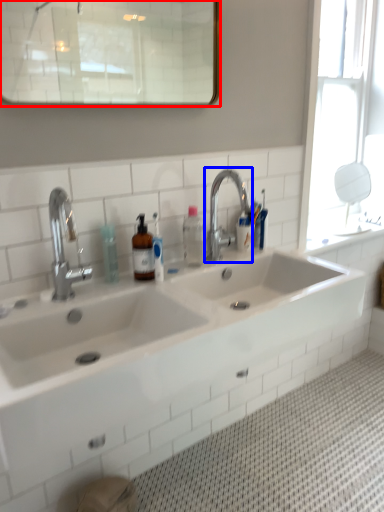
Question: Which object is closer to the camera taking this photo, mirror (highlighted by a red box) or tap (highlighted by a blue box)?

Choices:
 (A) mirror
 (B) tap

Answer: (A)